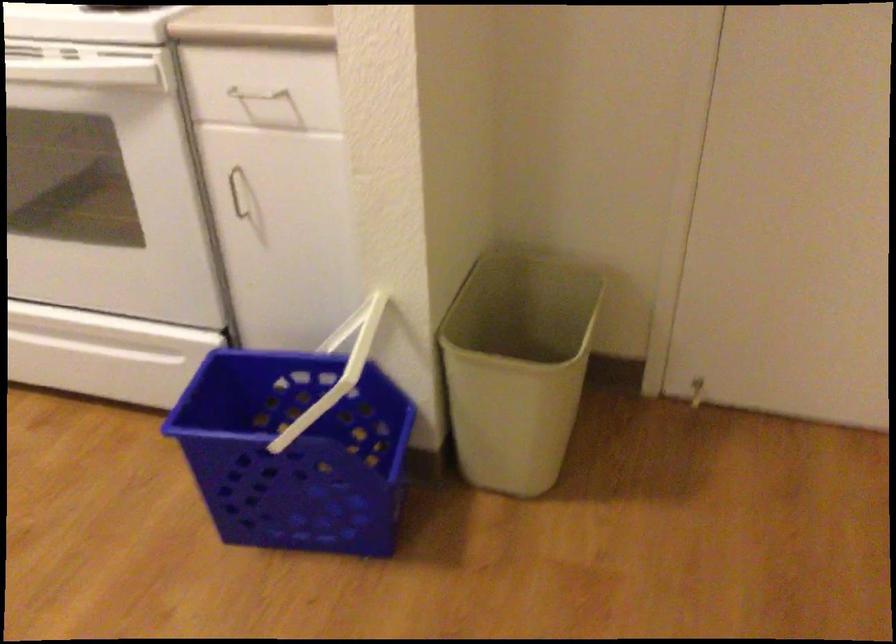
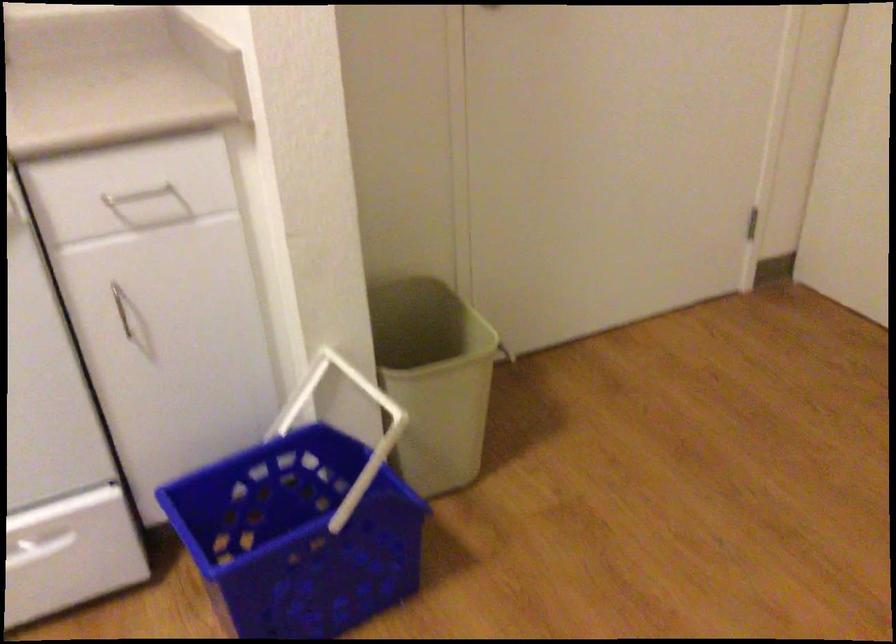
Locate, in the second image, the point that corresponds to pixel 243 192 in the first image.

(121, 307)